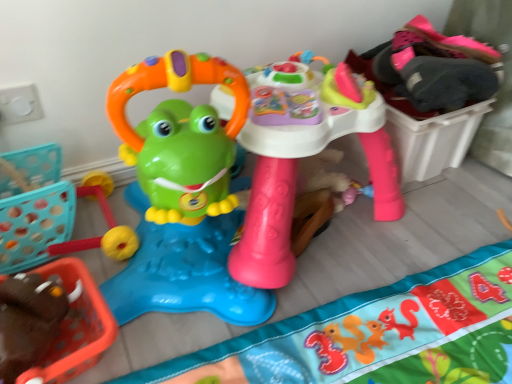
Find the location of `vacant space underneath soft fabric play mat at center (from a real-world perspective)`. vacant space underneath soft fabric play mat at center (from a real-world perspective) is located at coordinates (397, 342).